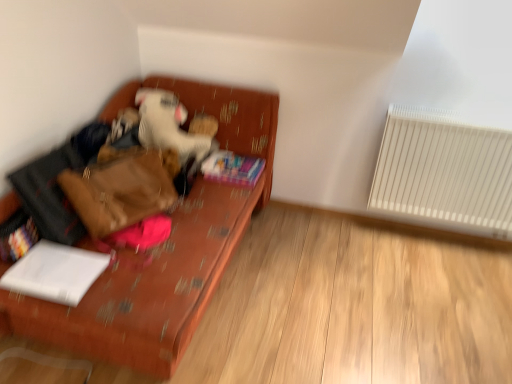
Image resolution: width=512 pixels, height=384 pixels. I want to click on multicolored plastic book at lower left, which is counted as the second book, starting from the top, so click(17, 236).

This screenshot has height=384, width=512. In order to click on multicolored paper book at center, arranged as the first book when viewed from the back in this screenshot , I will do `click(232, 168)`.

The image size is (512, 384). Find the location of `multicolored plastic book at lower left, which is the 3th book from right to left`. multicolored plastic book at lower left, which is the 3th book from right to left is located at coordinates (17, 236).

From the image's perspective, is white plush toy at center on top of white plastic radiator at right?

Yes, from the image's perspective, white plush toy at center is above white plastic radiator at right.

Is white plush toy at center not near white plastic radiator at right?

Absolutely, white plush toy at center is distant from white plastic radiator at right.

Between white plush toy at center and multicolored paper book at center, which appears as the third book when viewed from the left, which one has more height?

white plush toy at center.

Is white plush toy at center to the left of multicolored paper book at center, positioned as the 1th book in top-to-bottom order, from the viewer's perspective?

Indeed, white plush toy at center is positioned on the left side of multicolored paper book at center, positioned as the 1th book in top-to-bottom order.

Based on the photo, is multicolored plastic book at lower left, positioned as the second book in back-to-front order, further to camera compared to white paper at lower left, the 3th book from the top?

Yes, it is.

Considering the sizes of multicolored plastic book at lower left, the first book viewed from the left, and white paper at lower left, the 3th book from the top, in the image, is multicolored plastic book at lower left, the first book viewed from the left, taller or shorter than white paper at lower left, the 3th book from the top,?

Clearly, multicolored plastic book at lower left, the first book viewed from the left, is taller compared to white paper at lower left, the 3th book from the top.

From the image's perspective, is multicolored plastic book at lower left, which is the 3th book from right to left, over white paper at lower left, marked as the 1th book in a bottom-to-top arrangement?

Yes, from the image's perspective, multicolored plastic book at lower left, which is the 3th book from right to left, is over white paper at lower left, marked as the 1th book in a bottom-to-top arrangement.

Based on their sizes in the image, would you say multicolored paper book at center, which ranks as the third book in front-to-back order, is bigger or smaller than multicolored plastic book at lower left, positioned as the second book in back-to-front order?

multicolored paper book at center, which ranks as the third book in front-to-back order, is bigger than multicolored plastic book at lower left, positioned as the second book in back-to-front order.

From a real-world perspective, is multicolored paper book at center, which appears as the third book when viewed from the left, over multicolored plastic book at lower left, positioned as the second book in back-to-front order?

Incorrect, from a real-world perspective, multicolored paper book at center, which appears as the third book when viewed from the left, is lower than multicolored plastic book at lower left, positioned as the second book in back-to-front order.

How many degrees apart are the facing directions of multicolored paper book at center, arranged as the 1th book when viewed from the right, and multicolored plastic book at lower left, positioned as the second book in back-to-front order?

The facing directions of multicolored paper book at center, arranged as the 1th book when viewed from the right, and multicolored plastic book at lower left, positioned as the second book in back-to-front order, are 3.62 degrees apart.

Is multicolored paper book at center, arranged as the 1th book when viewed from the right, positioned with its back to multicolored plastic book at lower left, which ranks as the second book in front-to-back order?

No, multicolored paper book at center, arranged as the 1th book when viewed from the right,'s orientation is not away from multicolored plastic book at lower left, which ranks as the second book in front-to-back order.

Which of these two, white paper at lower left, which is counted as the 1th book, starting from the front, or white plush toy at center, stands shorter?

white paper at lower left, which is counted as the 1th book, starting from the front, is shorter.

Would you say white paper at lower left, the 3th book from the top, is a long distance from white plush toy at center?

No, white paper at lower left, the 3th book from the top, is in close proximity to white plush toy at center.

Can you confirm if white paper at lower left, marked as the 1th book in a bottom-to-top arrangement, is positioned to the left of white plush toy at center?

Yes.

You are a GUI agent. You are given a task and a screenshot of the screen. Output one action in this format:
    pyautogui.click(x=<x>, y=<y>)
    Task: Click on the book that is the 1st one above the textured orange couch at left (from a real-world perspective)
    
    Given the screenshot: What is the action you would take?
    pyautogui.click(x=232, y=168)

Considering the sizes of objects textured orange couch at left and multicolored paper book at center, which ranks as the third book in front-to-back order, in the image provided, who is taller, textured orange couch at left or multicolored paper book at center, which ranks as the third book in front-to-back order,?

textured orange couch at left is taller.

How many degrees apart are the facing directions of textured orange couch at left and multicolored paper book at center, positioned as the 1th book in top-to-bottom order?

The facing directions of textured orange couch at left and multicolored paper book at center, positioned as the 1th book in top-to-bottom order, are 0.313 degrees apart.

Which of these two, textured orange couch at left or multicolored paper book at center, positioned as the 1th book in top-to-bottom order, is thinner?

With smaller width is multicolored paper book at center, positioned as the 1th book in top-to-bottom order.

Is white plush toy at center at the back of multicolored paper book at center, the 3th book from the bottom?

No, multicolored paper book at center, the 3th book from the bottom, is not facing away from white plush toy at center.

Is white plush toy at center a part of multicolored paper book at center, which ranks as the third book in front-to-back order?

Definitely not — white plush toy at center is not inside multicolored paper book at center, which ranks as the third book in front-to-back order.

Based on their sizes in the image, would you say multicolored paper book at center, arranged as the 1th book when viewed from the right, is bigger or smaller than white plush toy at center?

Clearly, multicolored paper book at center, arranged as the 1th book when viewed from the right, is smaller in size than white plush toy at center.

Does multicolored paper book at center, arranged as the first book when viewed from the back, have a lesser height compared to white plush toy at center?

Yes, multicolored paper book at center, arranged as the first book when viewed from the back, is shorter than white plush toy at center.

Identify the location of clothing lying above the white plastic radiator at right (from the image's perspective). This screenshot has height=384, width=512. (169, 126).

The height and width of the screenshot is (384, 512). Find the location of `book behind the white plush toy at center`. book behind the white plush toy at center is located at coordinates click(232, 168).

Considering their positions, is multicolored plastic book at lower left, which is counted as the second book, starting from the top, positioned further to multicolored paper book at center, arranged as the first book when viewed from the back, than white plush toy at center?

multicolored plastic book at lower left, which is counted as the second book, starting from the top, is further to multicolored paper book at center, arranged as the first book when viewed from the back.

Considering their positions, is textured orange couch at left positioned closer to white plastic radiator at right than multicolored paper book at center, which appears as the third book when viewed from the left?

multicolored paper book at center, which appears as the third book when viewed from the left, is closer to white plastic radiator at right.

Which object lies further to the anchor point white plush toy at center, multicolored paper book at center, which ranks as the third book in front-to-back order, or white paper at lower left, the third book when ordered from back to front?

Based on the image, white paper at lower left, the third book when ordered from back to front, appears to be further to white plush toy at center.

When comparing their distances from white paper at lower left, placed as the second book when sorted from right to left, does multicolored plastic book at lower left, which is the 3th book from right to left, or textured orange couch at left seem further?

textured orange couch at left lies further to white paper at lower left, placed as the second book when sorted from right to left, than the other object.

Based on their spatial positions, is multicolored plastic book at lower left, which is the 3th book from right to left, or multicolored paper book at center, positioned as the 1th book in top-to-bottom order, further from white plastic radiator at right?

Among the two, multicolored plastic book at lower left, which is the 3th book from right to left, is located further to white plastic radiator at right.

Based on their spatial positions, is white plastic radiator at right or white plush toy at center further from textured orange couch at left?

The object further to textured orange couch at left is white plastic radiator at right.

From the image, which object appears to be farther from textured orange couch at left, multicolored paper book at center, arranged as the 1th book when viewed from the right, or multicolored plastic book at lower left, positioned as the second book in back-to-front order?

Based on the image, multicolored paper book at center, arranged as the 1th book when viewed from the right, appears to be further to textured orange couch at left.

Estimate the real-world distances between objects in this image. Which object is further from multicolored paper book at center, arranged as the first book when viewed from the back, white paper at lower left, placed as the second book when sorted from right to left, or white plastic radiator at right?

A: white plastic radiator at right is further to multicolored paper book at center, arranged as the first book when viewed from the back.

You are a GUI agent. You are given a task and a screenshot of the screen. Output one action in this format:
    pyautogui.click(x=<x>, y=<y>)
    Task: Click on the furniture located between white paper at lower left, the third book when ordered from back to front, and white plastic radiator at right in the left-right direction
    This screenshot has width=512, height=384.
    Given the screenshot: What is the action you would take?
    pyautogui.click(x=164, y=248)

At what (x,y) coordinates should I click in order to perform the action: click on clothing positioned between white paper at lower left, the third book when ordered from back to front, and multicolored paper book at center, which ranks as the third book in front-to-back order, from near to far. Please return your answer as a coordinate pair (x, y). Looking at the image, I should click on (169, 126).

Where is `book between white plush toy at center and white plastic radiator at right in the horizontal direction`? book between white plush toy at center and white plastic radiator at right in the horizontal direction is located at coordinates [232, 168].

Find the location of `book between textured orange couch at left and white plastic radiator at right`. book between textured orange couch at left and white plastic radiator at right is located at coordinates (232, 168).